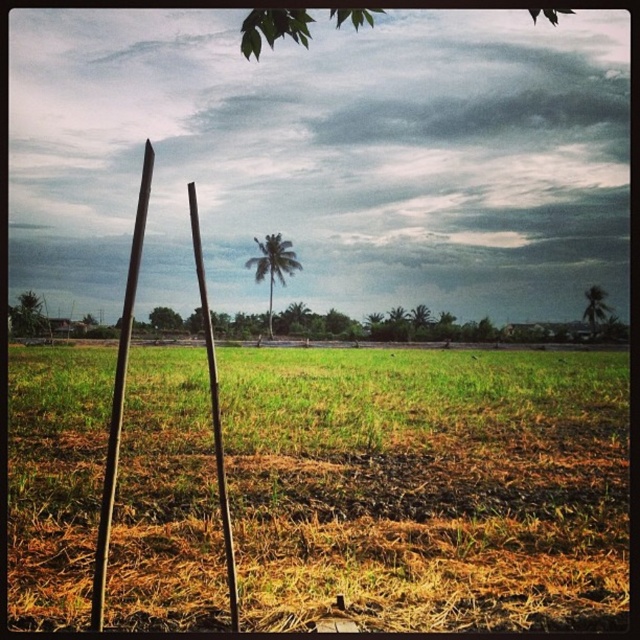
You are a hiker who wants to walk from the brown dry grass at center to the green leafy coconut tree at right. What is the approximate distance you need to cover?

The brown dry grass at center is 67.58 meters away from the green leafy coconut tree at right, so you need to cover approximately 67.58 meters to reach the tree.

You are an environmental scientist assessing tree health in this rural landscape. You observe the green leafy tree at left and the green leafy coconut tree at right. Which tree has a wider canopy spread?

The green leafy tree at left has a wider canopy spread than the green leafy coconut tree at right, as its width is larger according to the description.